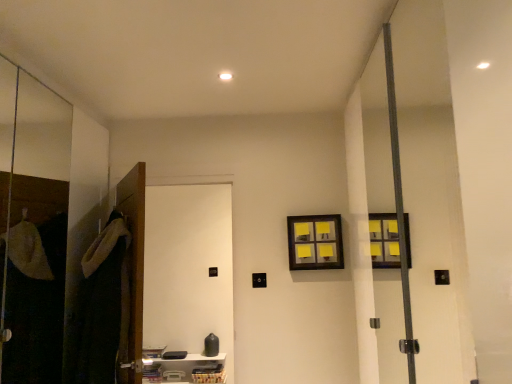
What do you see at coordinates (31, 225) in the screenshot? The width and height of the screenshot is (512, 384). I see `transparent glass screen door at left, arranged as the first screen door when viewed from the left` at bounding box center [31, 225].

What do you see at coordinates (101, 305) in the screenshot? This screenshot has height=384, width=512. I see `dark green fabric robe at left` at bounding box center [101, 305].

What do you see at coordinates (315, 242) in the screenshot? I see `yellow sticky notes at upper center` at bounding box center [315, 242].

Where is `wooden door at left`? wooden door at left is located at coordinates point(132,275).

Between yellow sticky notes at upper center and transparent glass screen door at left, the second screen door viewed from the right, which one is positioned behind?

yellow sticky notes at upper center is more distant.

From the image's perspective, which object appears higher, yellow sticky notes at upper center or transparent glass screen door at left, the second screen door viewed from the right?

transparent glass screen door at left, the second screen door viewed from the right, is shown above in the image.

Would you say yellow sticky notes at upper center is to the left or to the right of transparent glass screen door at left, arranged as the first screen door when viewed from the left, in the picture?

Based on their positions, yellow sticky notes at upper center is located to the right of transparent glass screen door at left, arranged as the first screen door when viewed from the left.

From a real-world perspective, relative to transparent glass screen door at left, arranged as the first screen door when viewed from the left, is yellow sticky notes at upper center vertically above or below?

Clearly, from a real-world perspective, yellow sticky notes at upper center is below transparent glass screen door at left, arranged as the first screen door when viewed from the left.

Are wooden door at left and yellow sticky notes at upper center far apart?

wooden door at left is positioned a significant distance from yellow sticky notes at upper center.

Locate an element on the screen. The height and width of the screenshot is (384, 512). glass window above the wooden door at left (from a real-world perspective) is located at coordinates (315, 242).

Is wooden door at left spatially inside yellow sticky notes at upper center, or outside of it?

The correct answer is: outside.

Is wooden door at left facing away from yellow sticky notes at upper center?

No, yellow sticky notes at upper center is not at the back of wooden door at left.

Looking at the image, does white matte door at left, marked as the 1th screen door in a right-to-left arrangement, seem bigger or smaller compared to yellow sticky notes at upper center?

Clearly, white matte door at left, marked as the 1th screen door in a right-to-left arrangement, is larger in size than yellow sticky notes at upper center.

Does white matte door at left, marked as the 1th screen door in a right-to-left arrangement, touch yellow sticky notes at upper center?

No.

Is white matte door at left, marked as the 1th screen door in a right-to-left arrangement, further to camera compared to yellow sticky notes at upper center?

No.

Is point (161, 224) positioned before point (304, 262)?

No, it is not.

Can you tell me how much white matte door at left, marked as the 1th screen door in a right-to-left arrangement, and dark green fabric robe at left differ in facing direction?

white matte door at left, marked as the 1th screen door in a right-to-left arrangement, and dark green fabric robe at left are facing 27.7 degrees away from each other.

Looking at this image, from a real-world perspective, relative to dark green fabric robe at left, is white matte door at left, which is the 2th screen door in left-to-right order, vertically above or below?

From a real-world perspective, white matte door at left, which is the 2th screen door in left-to-right order, is physically above dark green fabric robe at left.

Between point (220, 226) and point (113, 218), which one is positioned in front?

Positioned in front is point (113, 218).

Can you see white matte door at left, marked as the 1th screen door in a right-to-left arrangement, touching dark green fabric robe at left?

No, white matte door at left, marked as the 1th screen door in a right-to-left arrangement, is not next to dark green fabric robe at left.

Considering the relative sizes of transparent glass screen door at left, the second screen door viewed from the right, and dark green fabric robe at left in the image provided, is transparent glass screen door at left, the second screen door viewed from the right, bigger than dark green fabric robe at left?

Yes.

Can you confirm if transparent glass screen door at left, arranged as the first screen door when viewed from the left, is shorter than dark green fabric robe at left?

Answer: No.

Based on the photo, from a real-world perspective, is transparent glass screen door at left, the second screen door viewed from the right, located beneath dark green fabric robe at left?

No, from a real-world perspective, transparent glass screen door at left, the second screen door viewed from the right, is not under dark green fabric robe at left.

Between point (215, 373) and point (123, 316), which one is positioned behind?

The point (215, 373) is behind.

Between white plastic shelf at lower center and wooden door at left, which one has larger width?

With larger width is white plastic shelf at lower center.

Considering the relative sizes of white plastic shelf at lower center and wooden door at left in the image provided, is white plastic shelf at lower center smaller than wooden door at left?

Yes, white plastic shelf at lower center is smaller than wooden door at left.

From a real-world perspective, which object rests below the other?

white plastic shelf at lower center, from a real-world perspective.

Is yellow sticky notes at upper center next to wooden door at left?

No, yellow sticky notes at upper center is not beside wooden door at left.

Is yellow sticky notes at upper center positioned with its back to wooden door at left?

That's not correct — yellow sticky notes at upper center is not looking away from wooden door at left.

Find the location of a particular element. door that appears below the yellow sticky notes at upper center (from the image's perspective) is located at coordinates (132, 275).

From the image's perspective, is yellow sticky notes at upper center on wooden door at left?

Yes, from the image's perspective, yellow sticky notes at upper center is above wooden door at left.

At what (x,y) coordinates should I click in order to perform the action: click on screen door above the yellow sticky notes at upper center (from a real-world perspective). Please return your answer as a coordinate pair (x, y). The image size is (512, 384). Looking at the image, I should click on (31, 225).

Where is `glass window lying on the right of wooden door at left`? This screenshot has width=512, height=384. glass window lying on the right of wooden door at left is located at coordinates (315, 242).

Considering their positions, is transparent glass screen door at left, arranged as the first screen door when viewed from the left, positioned closer to dark green fabric robe at left than white plastic shelf at lower center?

transparent glass screen door at left, arranged as the first screen door when viewed from the left.

Based on their spatial positions, is wooden door at left or white plastic shelf at lower center closer to dark green fabric robe at left?

wooden door at left is closer to dark green fabric robe at left.

When comparing their distances from white plastic shelf at lower center, does wooden door at left or dark green fabric robe at left seem further?

wooden door at left lies further to white plastic shelf at lower center than the other object.

Looking at the image, which one is located closer to dark green fabric robe at left, white matte door at left, marked as the 1th screen door in a right-to-left arrangement, or wooden door at left?

wooden door at left is positioned closer to the anchor dark green fabric robe at left.

From the image, which object appears to be farther from transparent glass screen door at left, the second screen door viewed from the right, white matte door at left, which is the 2th screen door in left-to-right order, or wooden door at left?

white matte door at left, which is the 2th screen door in left-to-right order, is positioned further to the anchor transparent glass screen door at left, the second screen door viewed from the right.

Based on their spatial positions, is transparent glass screen door at left, arranged as the first screen door when viewed from the left, or white plastic shelf at lower center closer to yellow sticky notes at upper center?

The object closer to yellow sticky notes at upper center is white plastic shelf at lower center.

Estimate the real-world distances between objects in this image. Which object is further from white matte door at left, marked as the 1th screen door in a right-to-left arrangement, white plastic shelf at lower center or yellow sticky notes at upper center?

yellow sticky notes at upper center lies further to white matte door at left, marked as the 1th screen door in a right-to-left arrangement, than the other object.

When comparing their distances from yellow sticky notes at upper center, does white matte door at left, marked as the 1th screen door in a right-to-left arrangement, or white plastic shelf at lower center seem further?

The object further to yellow sticky notes at upper center is white matte door at left, marked as the 1th screen door in a right-to-left arrangement.

Locate an element on the screen. Image resolution: width=512 pixels, height=384 pixels. door between transparent glass screen door at left, arranged as the first screen door when viewed from the left, and white matte door at left, marked as the 1th screen door in a right-to-left arrangement, in the front-back direction is located at coordinates (132, 275).

This screenshot has height=384, width=512. I want to click on screen door between wooden door at left and white plastic shelf at lower center along the z-axis, so [189, 268].

Find the location of a particular element. The width and height of the screenshot is (512, 384). screen door located between transparent glass screen door at left, arranged as the first screen door when viewed from the left, and yellow sticky notes at upper center in the left-right direction is located at coordinates (189, 268).

This screenshot has height=384, width=512. What are the coordinates of `door between dark green fabric robe at left and yellow sticky notes at upper center from left to right` in the screenshot? It's located at (132, 275).